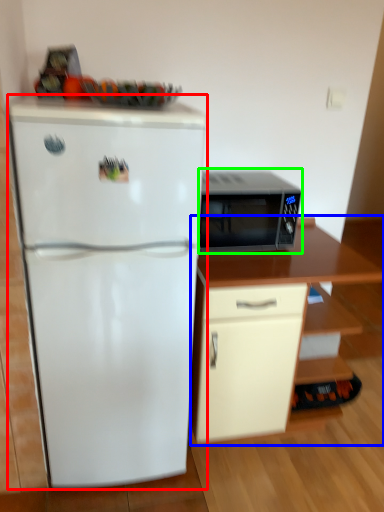
Question: Estimate the real-world distances between objects in this image. Which object is farther from refrigerator (highlighted by a red box), cabinetry (highlighted by a blue box) or microwave oven (highlighted by a green box)?

Choices:
 (A) cabinetry
 (B) microwave oven

Answer: (B)